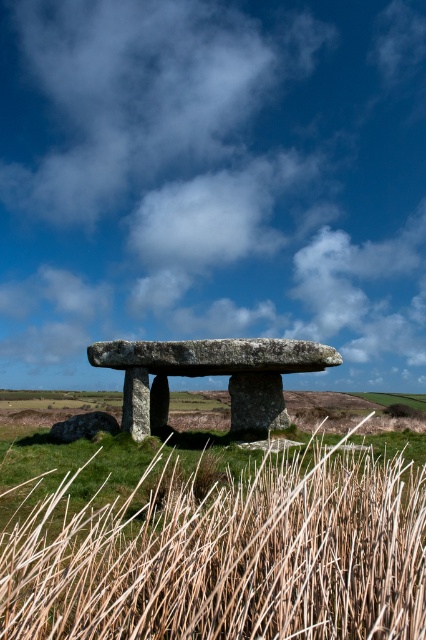
Question: Considering the real-world distances, which object is closest to the brown textured reed at lower left?

Choices:
 (A) rough stone dolmen at center
 (B) white fluffy cloud at upper center

Answer: (A)

Question: From the image, what is the correct spatial relationship of brown textured reed at lower left in relation to rough stone dolmen at center?

Choices:
 (A) above
 (B) below

Answer: (A)

Question: Which point is closer to the camera?

Choices:
 (A) (256, 545)
 (B) (106, 116)

Answer: (A)

Question: Estimate the real-world distances between objects in this image. Which object is farther from the white fluffy cloud at upper center?

Choices:
 (A) brown textured reed at lower left
 (B) rough stone dolmen at center

Answer: (A)

Question: Is brown textured reed at lower left thinner than rough stone dolmen at center?

Choices:
 (A) no
 (B) yes

Answer: (B)

Question: Does white fluffy cloud at upper center have a larger size compared to brown textured reed at lower left?

Choices:
 (A) yes
 (B) no

Answer: (A)